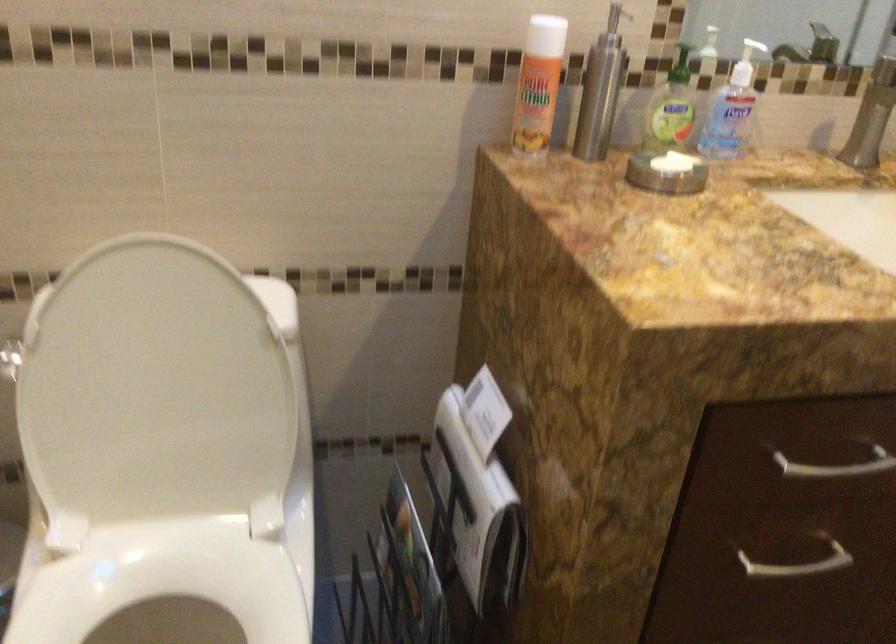
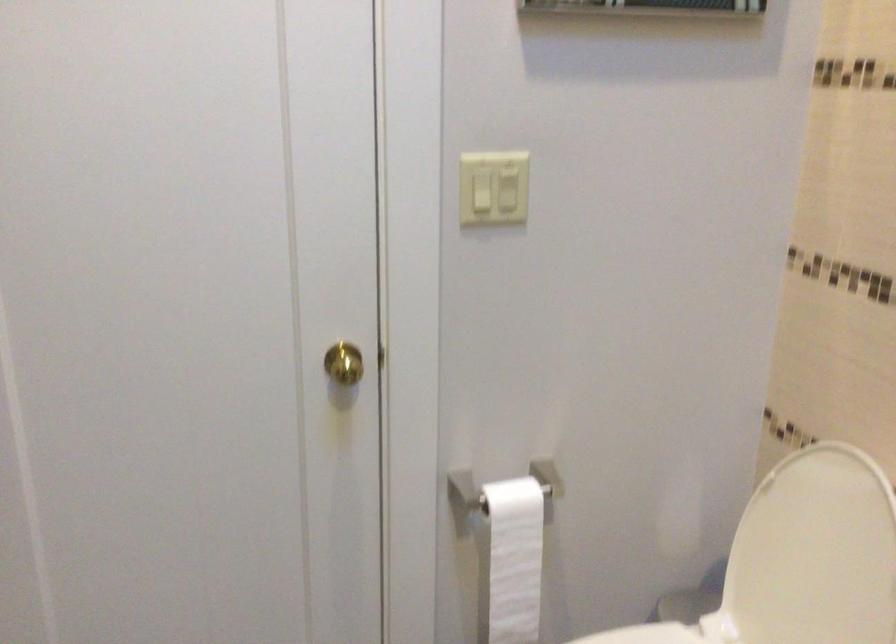
In the second image, find the point that corresponds to (x=141, y=377) in the first image.

(813, 554)